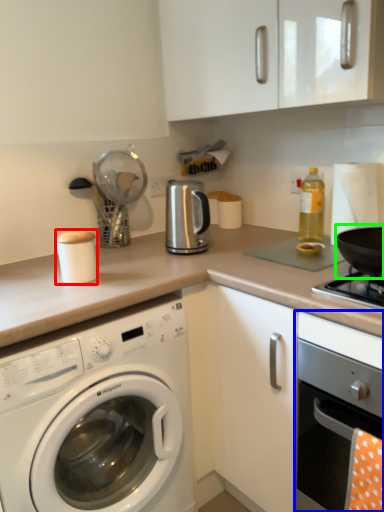
Question: Based on their relative distances, which object is farther from appliance (highlighted by a red box)? Choose from oven (highlighted by a blue box) and wok (highlighted by a green box).

Choices:
 (A) oven
 (B) wok

Answer: (B)